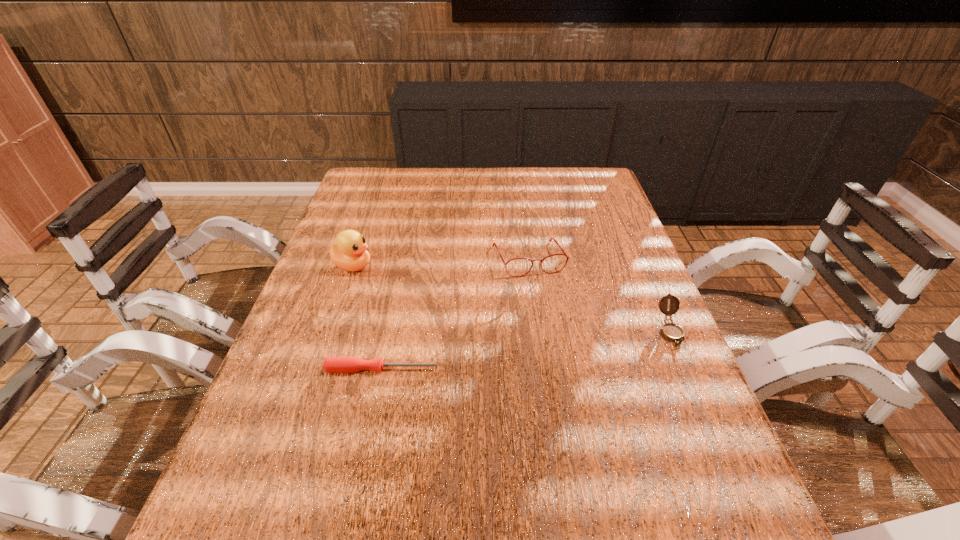
This screenshot has height=540, width=960. I want to click on vacant space that's between the third farthest object and the duckling, so click(x=512, y=298).

The image size is (960, 540). Find the location of `free spot between the screwdriver and the tallest object`. free spot between the screwdriver and the tallest object is located at coordinates (368, 317).

Locate an element on the screen. free space between the tallest object and the shortest object is located at coordinates (368, 317).

Select which object appears as the second closest to the nearest object. Please provide its 2D coordinates. Your answer should be formatted as a tuple, i.e. [(x, y)], where the tuple contains the x and y coordinates of a point satisfying the conditions above.

[(564, 254)]

Select which object appears as the second closest to the shortest object. Please provide its 2D coordinates. Your answer should be formatted as a tuple, i.e. [(x, y)], where the tuple contains the x and y coordinates of a point satisfying the conditions above.

[(564, 254)]